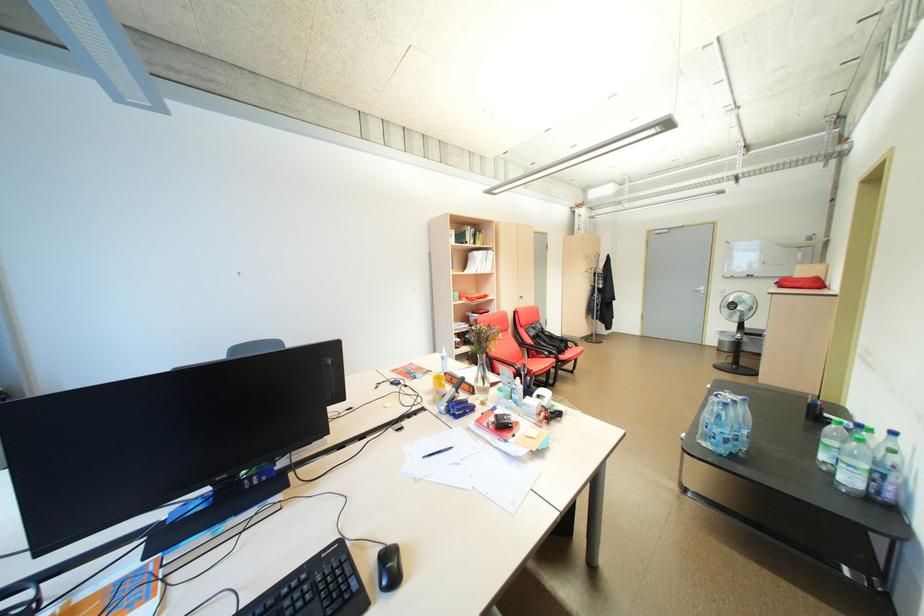
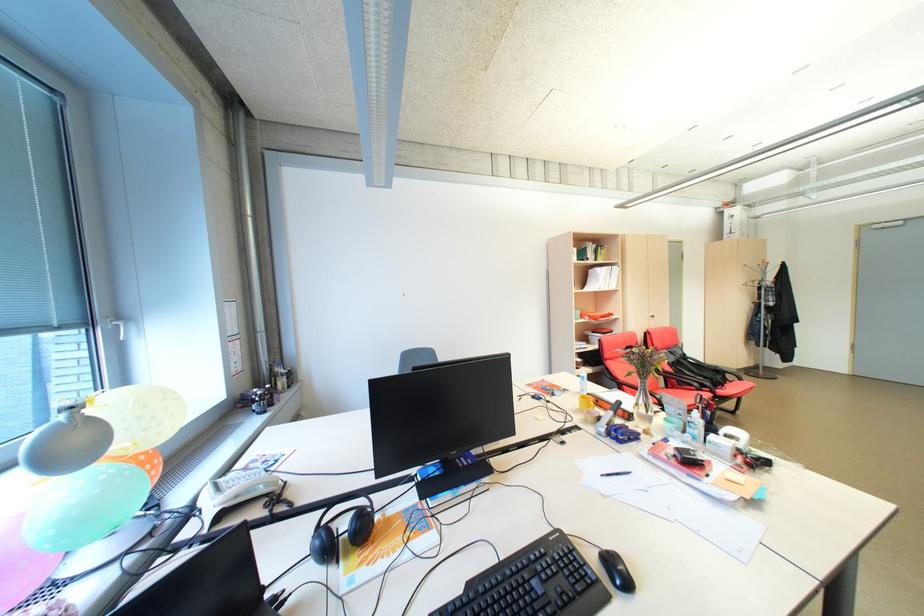
Find the pixel in the second image that matches the point at 485,379 in the first image.

(646, 406)